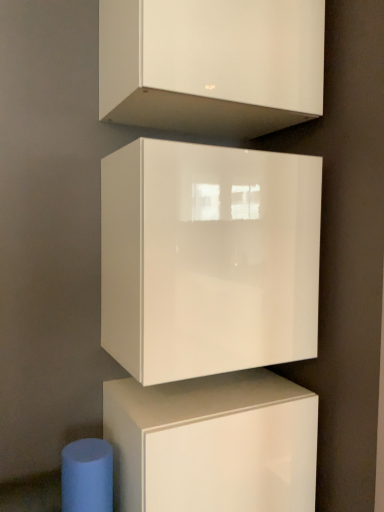
Question: Considering the relative positions of white glossy cabinet at upper center, which appears as the 3th cabinetry when ordered from the bottom, and glossy white cabinet at center, acting as the 1th cabinetry starting from the bottom, in the image provided, is white glossy cabinet at upper center, which appears as the 3th cabinetry when ordered from the bottom, to the right of glossy white cabinet at center, acting as the 1th cabinetry starting from the bottom, from the viewer's perspective?

Choices:
 (A) no
 (B) yes

Answer: (B)

Question: Is white glossy cabinet at upper center, which appears as the 3th cabinetry when ordered from the bottom, shorter than glossy white cabinet at center, acting as the 1th cabinetry starting from the bottom?

Choices:
 (A) no
 (B) yes

Answer: (B)

Question: Does white glossy cabinet at upper center, the 1th cabinetry viewed from the top, contain glossy white cabinet at center, which appears as the 3th cabinetry when viewed from the top?

Choices:
 (A) no
 (B) yes

Answer: (A)

Question: From the image's perspective, would you say white glossy cabinet at upper center, which appears as the 3th cabinetry when ordered from the bottom, is shown under glossy white cabinet at center, acting as the 1th cabinetry starting from the bottom?

Choices:
 (A) yes
 (B) no

Answer: (B)

Question: From a real-world perspective, is white glossy cabinet at upper center, the 1th cabinetry viewed from the top, over glossy white cabinet at center, acting as the 1th cabinetry starting from the bottom?

Choices:
 (A) no
 (B) yes

Answer: (B)

Question: In terms of height, does glossy white cabinet at center, acting as the 1th cabinetry starting from the bottom, look taller or shorter compared to glossy white cube at center, positioned as the 2th cabinetry in bottom-to-top order?

Choices:
 (A) short
 (B) tall

Answer: (A)

Question: In terms of size, does glossy white cabinet at center, acting as the 1th cabinetry starting from the bottom, appear bigger or smaller than glossy white cube at center, positioned as the 2th cabinetry in bottom-to-top order?

Choices:
 (A) small
 (B) big

Answer: (A)

Question: From a real-world perspective, relative to glossy white cube at center, which is the second cabinetry in top-to-bottom order, is glossy white cabinet at center, which appears as the 3th cabinetry when viewed from the top, vertically above or below?

Choices:
 (A) above
 (B) below

Answer: (B)

Question: Is glossy white cabinet at center, acting as the 1th cabinetry starting from the bottom, to the left or to the right of glossy white cube at center, which is the second cabinetry in top-to-bottom order, in the image?

Choices:
 (A) left
 (B) right

Answer: (A)

Question: Is glossy white cube at center, positioned as the 2th cabinetry in bottom-to-top order, spatially inside white glossy cabinet at upper center, which appears as the 3th cabinetry when ordered from the bottom, or outside of it?

Choices:
 (A) inside
 (B) outside

Answer: (B)

Question: Based on their sizes in the image, would you say glossy white cube at center, which is the second cabinetry in top-to-bottom order, is bigger or smaller than white glossy cabinet at upper center, which appears as the 3th cabinetry when ordered from the bottom?

Choices:
 (A) big
 (B) small

Answer: (A)

Question: Is glossy white cube at center, positioned as the 2th cabinetry in bottom-to-top order, in front of or behind white glossy cabinet at upper center, the 1th cabinetry viewed from the top, in the image?

Choices:
 (A) front
 (B) behind

Answer: (B)

Question: Is point (302, 253) positioned closer to the camera than point (130, 29)?

Choices:
 (A) closer
 (B) farther

Answer: (B)

Question: Does point click(x=152, y=475) appear closer or farther from the camera than point click(x=291, y=7)?

Choices:
 (A) farther
 (B) closer

Answer: (B)

Question: Considering the positions of glossy white cabinet at center, acting as the 1th cabinetry starting from the bottom, and white glossy cabinet at upper center, the 1th cabinetry viewed from the top, in the image, is glossy white cabinet at center, acting as the 1th cabinetry starting from the bottom, wider or thinner than white glossy cabinet at upper center, the 1th cabinetry viewed from the top,?

Choices:
 (A) thin
 (B) wide

Answer: (B)